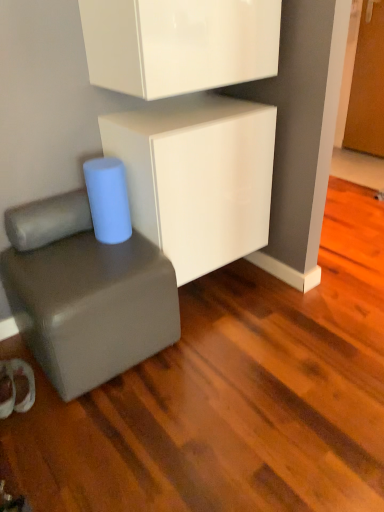
Question: Does matte gray cube at lower left appear on the left side of glossy white cabinet at upper center, the first cabinetry viewed from the top?

Choices:
 (A) no
 (B) yes

Answer: (B)

Question: Can you see matte gray cube at lower left touching glossy white cabinet at upper center, which is counted as the 2th cabinetry, starting from the bottom?

Choices:
 (A) yes
 (B) no

Answer: (B)

Question: Is matte gray cube at lower left facing away from glossy white cabinet at upper center, the first cabinetry viewed from the top?

Choices:
 (A) yes
 (B) no

Answer: (B)

Question: Can you confirm if matte gray cube at lower left is taller than glossy white cabinet at upper center, the first cabinetry viewed from the top?

Choices:
 (A) no
 (B) yes

Answer: (B)

Question: From the image's perspective, would you say matte gray cube at lower left is shown under glossy white cabinet at upper center, the first cabinetry viewed from the top?

Choices:
 (A) no
 (B) yes

Answer: (B)

Question: Does matte gray cube at lower left have a greater width compared to glossy white cabinet at upper center, the first cabinetry viewed from the top?

Choices:
 (A) no
 (B) yes

Answer: (B)

Question: Is glossy white cabinet at upper center, the first cabinetry viewed from the top, at the right side of white glossy cabinet at center, which appears as the 2th cabinetry when viewed from the top?

Choices:
 (A) no
 (B) yes

Answer: (A)

Question: Is glossy white cabinet at upper center, the first cabinetry viewed from the top, taller than white glossy cabinet at center, marked as the first cabinetry in a bottom-to-top arrangement?

Choices:
 (A) yes
 (B) no

Answer: (B)

Question: Is the surface of glossy white cabinet at upper center, which is counted as the 2th cabinetry, starting from the bottom, in direct contact with white glossy cabinet at center, which appears as the 2th cabinetry when viewed from the top?

Choices:
 (A) no
 (B) yes

Answer: (A)

Question: Considering the relative positions of glossy white cabinet at upper center, the first cabinetry viewed from the top, and white glossy cabinet at center, marked as the first cabinetry in a bottom-to-top arrangement, in the image provided, is glossy white cabinet at upper center, the first cabinetry viewed from the top, to the left of white glossy cabinet at center, marked as the first cabinetry in a bottom-to-top arrangement, from the viewer's perspective?

Choices:
 (A) yes
 (B) no

Answer: (A)

Question: Are glossy white cabinet at upper center, the first cabinetry viewed from the top, and white glossy cabinet at center, which appears as the 2th cabinetry when viewed from the top, far apart?

Choices:
 (A) yes
 (B) no

Answer: (B)

Question: Does glossy white cabinet at upper center, the first cabinetry viewed from the top, have a smaller size compared to white glossy cabinet at center, which appears as the 2th cabinetry when viewed from the top?

Choices:
 (A) no
 (B) yes

Answer: (B)

Question: Is white glossy cabinet at center, which appears as the 2th cabinetry when viewed from the top, at the back of matte gray cube at lower left?

Choices:
 (A) no
 (B) yes

Answer: (A)